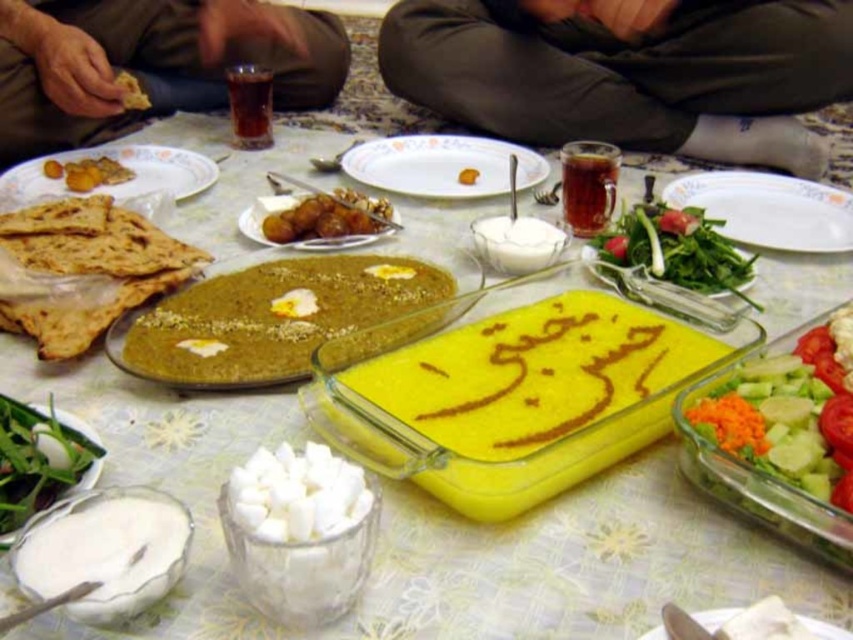
You are a guest at this meal and want to choose between the green leafy vegetables at lower right and the golden fried pastry at upper left. Which option is bigger in size?

The green leafy vegetables at lower right has a larger size compared to the golden fried pastry at upper left, so the green leafy vegetables at lower right is bigger in size.

Consider the image. You are a guest at this meal and want to reach both the white ceramic plate at center and the golden brown fried balls at center from your current position. What is the minimum distance you need to move to touch both items?

The white ceramic plate at center is 17.07 inches away from the golden brown fried balls at center. To touch both items, you need to move at least 17.07 inches.